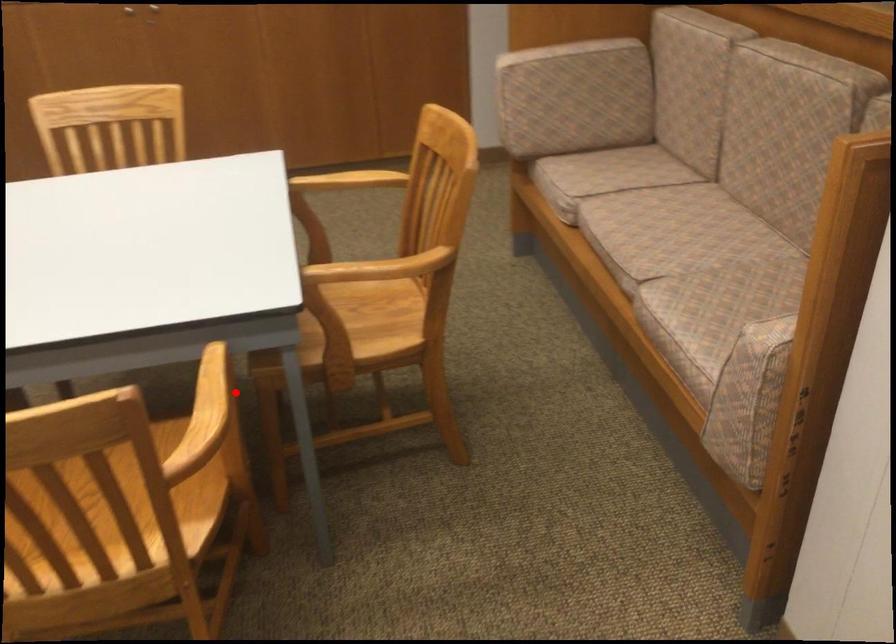
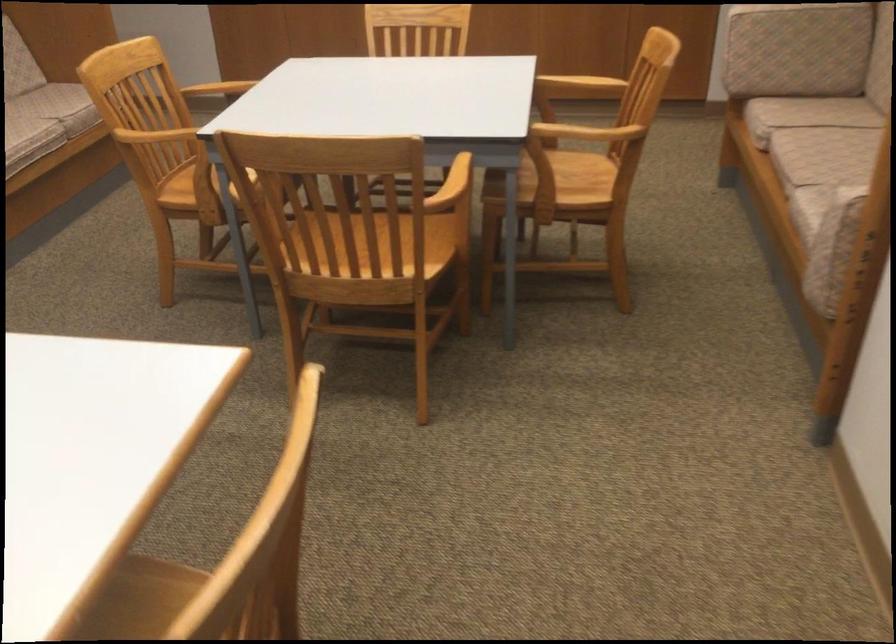
Question: I am providing you with two images of the same scene from different viewpoints. Given a red point in image1, look at the same physical point in image2. Is it:

Choices:
 (A) Closer to the viewpoint
 (B) Farther from the viewpoint

Answer: (B)